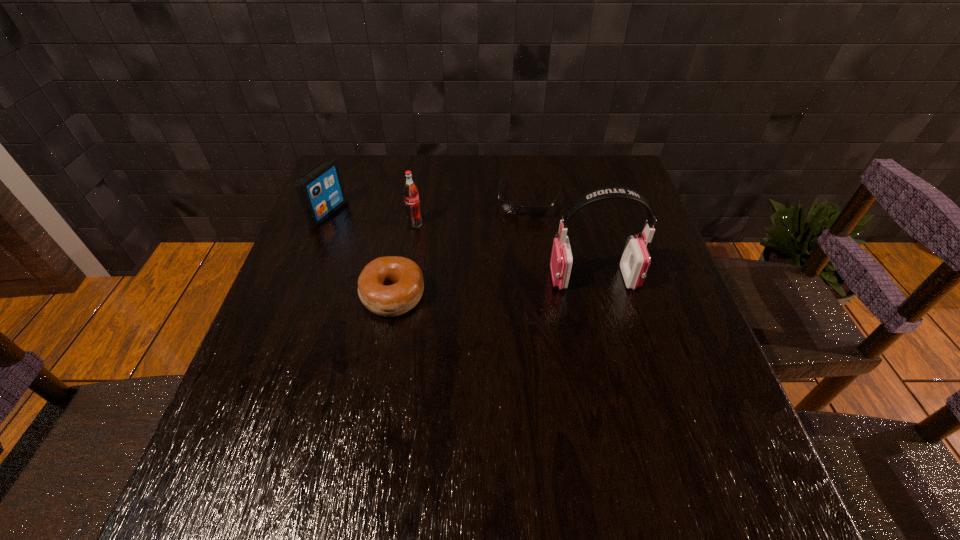
Identify the location of bagel. This screenshot has width=960, height=540. (389, 286).

You are a GUI agent. You are given a task and a screenshot of the screen. Output one action in this format:
    pyautogui.click(x=<x>, y=<y>)
    Task: Click on the tallest object
    Image resolution: width=960 pixels, height=540 pixels.
    Given the screenshot: What is the action you would take?
    pyautogui.click(x=635, y=261)

Locate an element on the screen. soda bottle is located at coordinates (411, 197).

Locate an element on the screen. Image resolution: width=960 pixels, height=540 pixels. iPod is located at coordinates (320, 191).

Locate an element on the screen. This screenshot has width=960, height=540. the third tallest object is located at coordinates (320, 191).

In order to click on the shortest object in this screenshot , I will do `click(511, 208)`.

You are a GUI agent. You are given a task and a screenshot of the screen. Output one action in this format:
    pyautogui.click(x=<x>, y=<y>)
    Task: Click on the free space located on the back of the bagel
    This screenshot has width=960, height=540.
    Given the screenshot: What is the action you would take?
    pyautogui.click(x=412, y=194)

Find the location of a particular element. This screenshot has height=540, width=960. blank area located 0.310m on the outer surface of the tallest object is located at coordinates (420, 279).

Locate an element on the screen. This screenshot has width=960, height=540. vacant area situated 0.210m on the outer surface of the tallest object is located at coordinates (463, 279).

Identify the location of free space located on the outer surface of the tallest object. The image size is (960, 540). (526, 279).